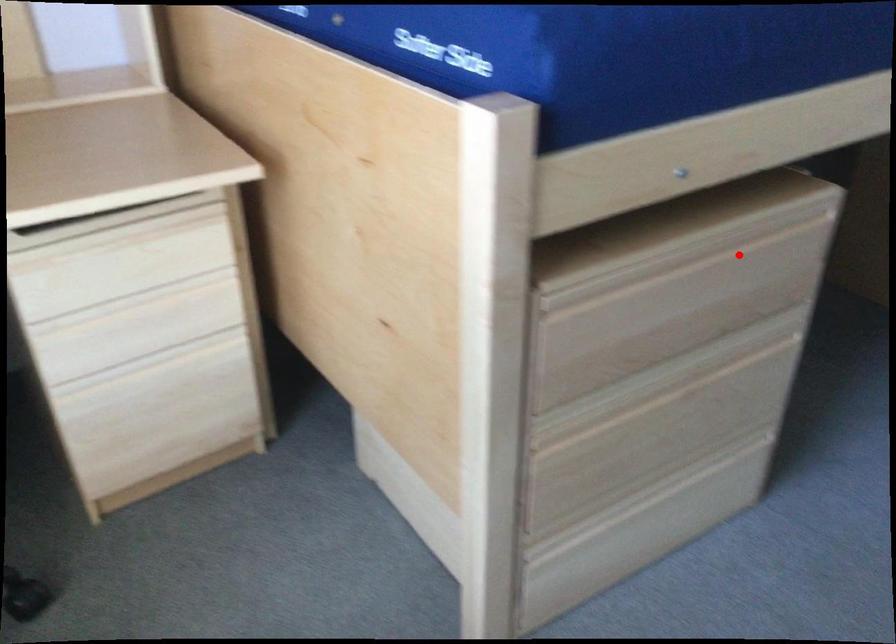
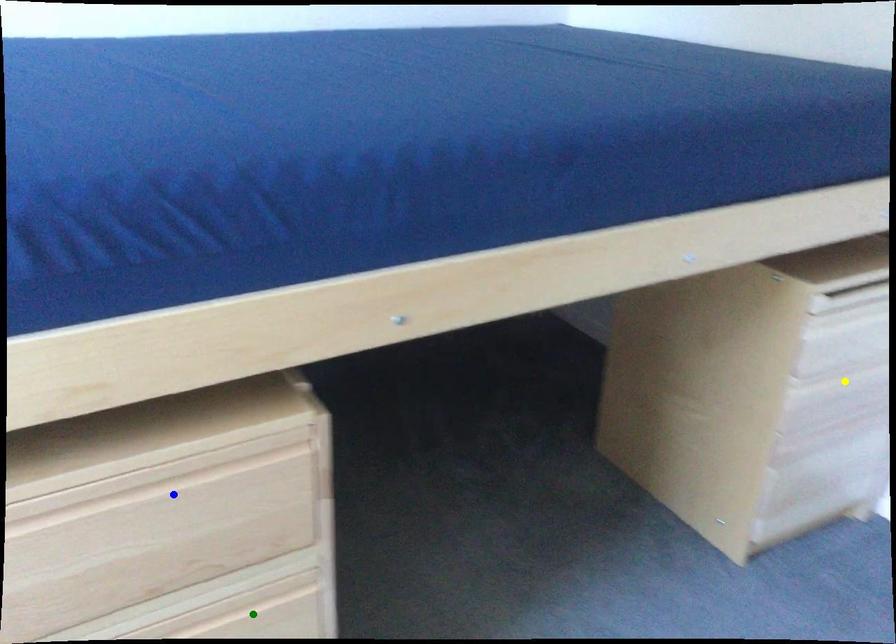
Question: I am providing you with two images of the same scene from different viewpoints. A red point is marked on the first image. You are given multiple points on the second image. Which point in image 2 is actually the same real-world point as the red point in image 1?

Choices:
 (A) blue point
 (B) green point
 (C) yellow point

Answer: (A)